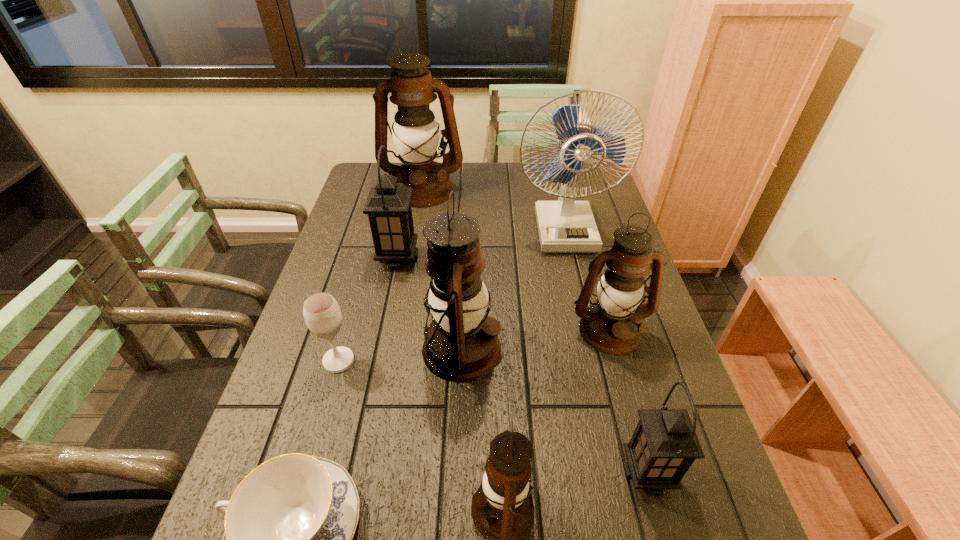
Locate an element on the screen. free space located on the side of the farthest brown lantern, there is a wick adjustment knob is located at coordinates (407, 276).

Where is `free space located 0.300m on the front-facing side of the blue fan`? The height and width of the screenshot is (540, 960). free space located 0.300m on the front-facing side of the blue fan is located at coordinates (588, 330).

This screenshot has height=540, width=960. In order to click on vacant space located 0.290m on the side of the second tallest lantern, there is a wick adjustment knob in this screenshot , I will do `click(619, 349)`.

Find the location of a particular element. The image size is (960, 540). vacant space located 0.210m on the front of the left black lantern is located at coordinates (384, 327).

This screenshot has width=960, height=540. What are the coordinates of `free spot located 0.290m on the side of the rightmost brown lantern, there is a wick adjustment knob` in the screenshot? It's located at (650, 476).

Image resolution: width=960 pixels, height=540 pixels. I want to click on free space located 0.250m on the left of the right black lantern, so click(496, 473).

Identify the location of free spot located on the right of the eighth tallest object. (483, 361).

Where is `object located at the far edge`? The height and width of the screenshot is (540, 960). object located at the far edge is located at coordinates (415, 133).

Where is `wineglass present at the left edge`? wineglass present at the left edge is located at coordinates (322, 314).

In order to click on fan that is at the right edge in this screenshot , I will do `click(565, 226)`.